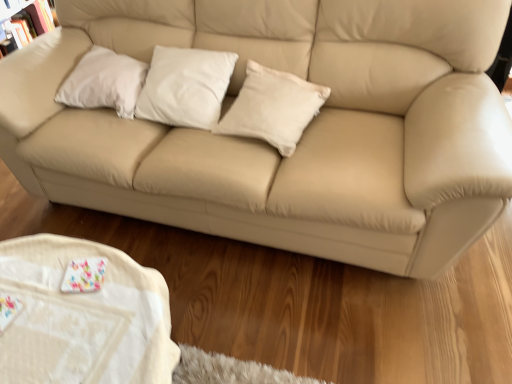
Question: Is matte white bookcase at upper left smaller than white cotton pillow at center, which is counted as the first pillow, starting from the right?

Choices:
 (A) yes
 (B) no

Answer: (B)

Question: Is matte white bookcase at upper left taller than white cotton pillow at center, which is counted as the first pillow, starting from the right?

Choices:
 (A) yes
 (B) no

Answer: (A)

Question: Can you confirm if matte white bookcase at upper left is shorter than white cotton pillow at center, which is counted as the first pillow, starting from the right?

Choices:
 (A) no
 (B) yes

Answer: (A)

Question: Is there a large distance between matte white bookcase at upper left and white cotton pillow at center, which is counted as the first pillow, starting from the right?

Choices:
 (A) yes
 (B) no

Answer: (A)

Question: Does matte white bookcase at upper left lie in front of white cotton pillow at center, placed as the third pillow when sorted from left to right?

Choices:
 (A) no
 (B) yes

Answer: (A)

Question: Is the depth of matte white bookcase at upper left greater than that of white cotton pillow at center, which is counted as the first pillow, starting from the right?

Choices:
 (A) yes
 (B) no

Answer: (A)

Question: Is white cotton pillow at center, placed as the third pillow when sorted from left to right, a part of white fabric table at lower left?

Choices:
 (A) no
 (B) yes

Answer: (A)

Question: Does white fabric table at lower left have a greater width compared to white cotton pillow at center, placed as the third pillow when sorted from left to right?

Choices:
 (A) no
 (B) yes

Answer: (B)

Question: Is white fabric table at lower left shorter than white cotton pillow at center, placed as the third pillow when sorted from left to right?

Choices:
 (A) yes
 (B) no

Answer: (B)

Question: Does white fabric table at lower left have a smaller size compared to white cotton pillow at center, placed as the third pillow when sorted from left to right?

Choices:
 (A) yes
 (B) no

Answer: (B)

Question: Is white fabric table at lower left facing away from white cotton pillow at center, placed as the third pillow when sorted from left to right?

Choices:
 (A) no
 (B) yes

Answer: (A)

Question: Is white fabric table at lower left positioned beyond the bounds of white cotton pillow at center, placed as the third pillow when sorted from left to right?

Choices:
 (A) yes
 (B) no

Answer: (A)

Question: Would you say beige leather couch at center contains white fabric table at lower left?

Choices:
 (A) yes
 (B) no

Answer: (B)